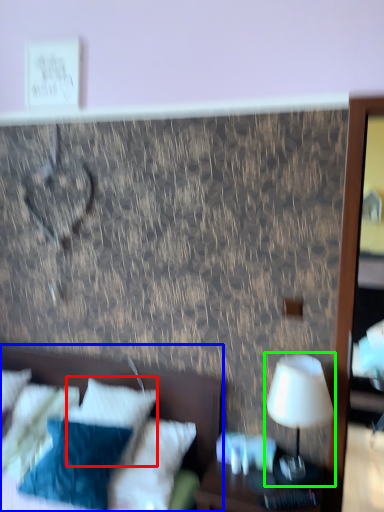
Question: Estimate the real-world distances between objects in this image. Which object is farther from pillow (highlighted by a red box), bed (highlighted by a blue box) or table lamp (highlighted by a green box)?

Choices:
 (A) bed
 (B) table lamp

Answer: (B)